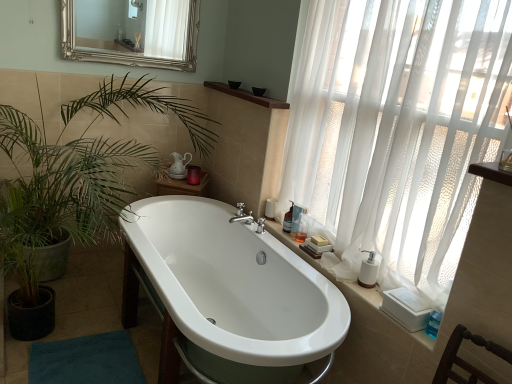
What are the coordinates of `free area below silver/gilded mirror at upper center (from a real-world perspective)` in the screenshot? It's located at (143, 74).